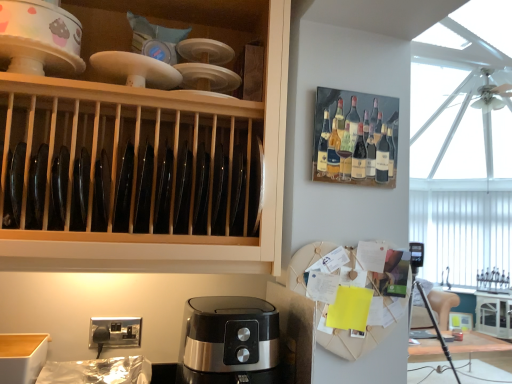
Measure the distance between white glossy cabinet at right, which ranks as the first cabinetry in right-to-left order, and camera.

white glossy cabinet at right, which ranks as the first cabinetry in right-to-left order, is 12.76 feet away from camera.

Describe the element at coordinates (228, 340) in the screenshot. I see `satin black coffee maker at lower center` at that location.

What is the approximate width of satin black coffee maker at lower center?

The width of satin black coffee maker at lower center is 12.69 inches.

Image resolution: width=512 pixels, height=384 pixels. What do you see at coordinates (152, 149) in the screenshot?
I see `black matte cabinet at upper left, arranged as the 1th cabinetry when viewed from the left` at bounding box center [152, 149].

You are a GUI agent. You are given a task and a screenshot of the screen. Output one action in this format:
    pyautogui.click(x=<x>, y=<y>)
    Task: Click on the white glossy cabinet at right, the second cabinetry from the front
    Image resolution: width=512 pixels, height=384 pixels.
    Given the screenshot: What is the action you would take?
    pyautogui.click(x=494, y=314)

Where is `cabinetry that is behind the black matte cabinet at upper left, which appears as the first cabinetry when viewed from the front`? The image size is (512, 384). cabinetry that is behind the black matte cabinet at upper left, which appears as the first cabinetry when viewed from the front is located at coordinates (494, 314).

Considering the positions of objects black matte cabinet at upper left, arranged as the 1th cabinetry when viewed from the left, and white glossy cabinet at right, acting as the second cabinetry starting from the top, in the image provided, who is more to the left, black matte cabinet at upper left, arranged as the 1th cabinetry when viewed from the left, or white glossy cabinet at right, acting as the second cabinetry starting from the top,?

From the viewer's perspective, black matte cabinet at upper left, arranged as the 1th cabinetry when viewed from the left, appears more on the left side.

Does point (148, 241) appear closer or farther from the camera than point (486, 321)?

Point (148, 241) is closer to the camera than point (486, 321).

Choose the correct answer: Is satin black coffee maker at lower center inside black matte cabinet at upper left, the 2th cabinetry positioned from the right, or outside it?

satin black coffee maker at lower center exists outside the volume of black matte cabinet at upper left, the 2th cabinetry positioned from the right.

Which of these two, satin black coffee maker at lower center or black matte cabinet at upper left, the 2th cabinetry positioned from the bottom, is thinner?

satin black coffee maker at lower center.

From the image's perspective, is satin black coffee maker at lower center located above or below black matte cabinet at upper left, which appears as the first cabinetry when viewed from the front?

Based on their image positions, satin black coffee maker at lower center is located beneath black matte cabinet at upper left, which appears as the first cabinetry when viewed from the front.

How distant is satin black coffee maker at lower center from black matte cabinet at upper left, the 2th cabinetry positioned from the bottom?

The distance of satin black coffee maker at lower center from black matte cabinet at upper left, the 2th cabinetry positioned from the bottom, is 15.54 inches.

In the image, is matte ceramic bowl at upper left positioned in front of or behind wooden plate rack at upper right?

In the image, matte ceramic bowl at upper left appears in front of wooden plate rack at upper right.

Which of these two, matte ceramic bowl at upper left or wooden plate rack at upper right, is bigger?

Bigger between the two is matte ceramic bowl at upper left.

Is matte ceramic bowl at upper left facing away from wooden plate rack at upper right?

That's not correct — matte ceramic bowl at upper left is not looking away from wooden plate rack at upper right.

From a real-world perspective, is matte ceramic bowl at upper left below wooden plate rack at upper right?

No, from a real-world perspective, matte ceramic bowl at upper left is not below wooden plate rack at upper right.

Considering the points (484, 303) and (31, 54), which point is behind, point (484, 303) or point (31, 54)?

The point (484, 303) is behind.

Does white glossy cabinet at right, which ranks as the first cabinetry in right-to-left order, appear on the left side of matte ceramic bowl at upper left?

Incorrect, white glossy cabinet at right, which ranks as the first cabinetry in right-to-left order, is not on the left side of matte ceramic bowl at upper left.

From a real-world perspective, is white glossy cabinet at right, positioned as the second cabinetry in left-to-right order, physically above matte ceramic bowl at upper left?

No.

Is black matte cabinet at upper left, which appears as the first cabinetry when viewed from the front, closer to camera compared to matte ceramic bowl at upper left?

Yes.

Between black matte cabinet at upper left, the 2th cabinetry positioned from the bottom, and matte ceramic bowl at upper left, which one has larger width?

black matte cabinet at upper left, the 2th cabinetry positioned from the bottom.

Are black matte cabinet at upper left, which appears as the first cabinetry when viewed from the front, and matte ceramic bowl at upper left beside each other?

No, black matte cabinet at upper left, which appears as the first cabinetry when viewed from the front, is not in contact with matte ceramic bowl at upper left.

Considering the sizes of objects black matte cabinet at upper left, arranged as the 1th cabinetry when viewed from the left, and matte ceramic bowl at upper left in the image provided, who is taller, black matte cabinet at upper left, arranged as the 1th cabinetry when viewed from the left, or matte ceramic bowl at upper left?

black matte cabinet at upper left, arranged as the 1th cabinetry when viewed from the left.

How many degrees apart are the facing directions of black matte cabinet at upper left, which appears as the first cabinetry when viewed from the front, and satin black coffee maker at lower center?

There is a 0.0807-degree angle between the facing directions of black matte cabinet at upper left, which appears as the first cabinetry when viewed from the front, and satin black coffee maker at lower center.

Which point is more distant from viewer, (162, 259) or (249, 306)?

The point (249, 306) is farther from the camera.

Choose the correct answer: Is black matte cabinet at upper left, the 2th cabinetry positioned from the right, inside satin black coffee maker at lower center or outside it?

The correct answer is: outside.

Does wooden plate rack at upper right contain satin black coffee maker at lower center?

No, satin black coffee maker at lower center is not a part of wooden plate rack at upper right.

Is wooden plate rack at upper right oriented towards satin black coffee maker at lower center?

No, wooden plate rack at upper right does not turn towards satin black coffee maker at lower center.

Where is `cabinetry above the white glossy cabinet at right, acting as the second cabinetry starting from the top (from a real-world perspective)`? The height and width of the screenshot is (384, 512). cabinetry above the white glossy cabinet at right, acting as the second cabinetry starting from the top (from a real-world perspective) is located at coordinates (152, 149).

Find the location of a particular element. This screenshot has width=512, height=384. cabinetry to the left of satin black coffee maker at lower center is located at coordinates (152, 149).

Based on their spatial positions, is satin black coffee maker at lower center or matte ceramic bowl at upper left further from black matte cabinet at upper left, which appears as the first cabinetry when viewed from the front?

satin black coffee maker at lower center is further to black matte cabinet at upper left, which appears as the first cabinetry when viewed from the front.

From the image, which object appears to be nearer to satin black coffee maker at lower center, wooden plate rack at upper right or white glossy cabinet at right, the first cabinetry in the bottom-to-top sequence?

wooden plate rack at upper right is positioned closer to the anchor satin black coffee maker at lower center.

When comparing their distances from black matte cabinet at upper left, arranged as the 1th cabinetry when viewed from the left, does matte ceramic bowl at upper left or wooden plate rack at upper right seem further?

wooden plate rack at upper right is positioned further to the anchor black matte cabinet at upper left, arranged as the 1th cabinetry when viewed from the left.

When comparing their distances from black matte cabinet at upper left, which appears as the first cabinetry when viewed from the front, does wooden plate rack at upper right or satin black coffee maker at lower center seem further?

wooden plate rack at upper right is positioned further to the anchor black matte cabinet at upper left, which appears as the first cabinetry when viewed from the front.

Which object lies further to the anchor point wooden plate rack at upper right, black matte cabinet at upper left, the second cabinetry in the back-to-front sequence, or matte ceramic bowl at upper left?

matte ceramic bowl at upper left.

Which object lies further to the anchor point white glossy cabinet at right, the first cabinetry in the bottom-to-top sequence, wooden plate rack at upper right or matte ceramic bowl at upper left?

matte ceramic bowl at upper left lies further to white glossy cabinet at right, the first cabinetry in the bottom-to-top sequence, than the other object.

When comparing their distances from black matte cabinet at upper left, arranged as the 1th cabinetry when viewed from the left, does matte ceramic bowl at upper left or satin black coffee maker at lower center seem closer?

The object closer to black matte cabinet at upper left, arranged as the 1th cabinetry when viewed from the left, is matte ceramic bowl at upper left.

Looking at the image, which one is located further to white glossy cabinet at right, the second cabinetry from the front, matte ceramic bowl at upper left or satin black coffee maker at lower center?

Among the two, matte ceramic bowl at upper left is located further to white glossy cabinet at right, the second cabinetry from the front.

This screenshot has width=512, height=384. I want to click on coffee maker between matte ceramic bowl at upper left and white glossy cabinet at right, acting as the second cabinetry starting from the top, in the front-back direction, so click(x=228, y=340).

The height and width of the screenshot is (384, 512). I want to click on shelf located between matte ceramic bowl at upper left and white glossy cabinet at right, acting as the second cabinetry starting from the top, in the depth direction, so click(355, 138).

Locate an element on the screen. Image resolution: width=512 pixels, height=384 pixels. coffee maker between black matte cabinet at upper left, which appears as the first cabinetry when viewed from the front, and white glossy cabinet at right, the second cabinetry from the front, from front to back is located at coordinates (228, 340).

At what (x,y) coordinates should I click in order to perform the action: click on shelf between satin black coffee maker at lower center and white glossy cabinet at right, which ranks as the first cabinetry in right-to-left order, from front to back. Please return your answer as a coordinate pair (x, y). The width and height of the screenshot is (512, 384). Looking at the image, I should click on click(355, 138).